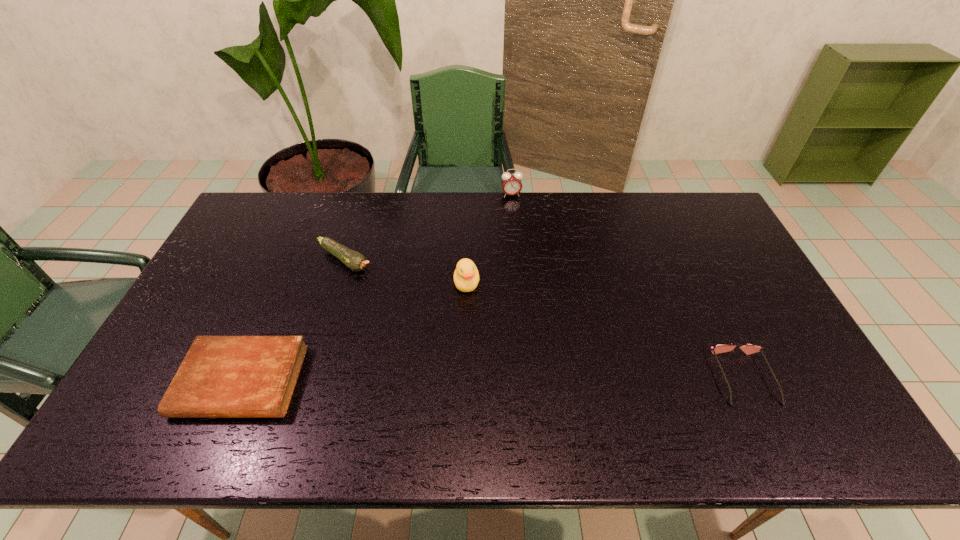
This screenshot has width=960, height=540. In order to click on vacant space on the desktop that is between the Bible and the rightmost object and is positioned on the clock face of the fourth object from left to right in this screenshot , I will do `click(557, 379)`.

Identify the location of vacant space on the desktop that is between the Bible and the rightmost object and is positioned on the face of the third object from left to right. (468, 380).

Where is `vacant space on the desktop that is between the Bible and the rightmost object and is positioned at the blossom end of the zucchini`? vacant space on the desktop that is between the Bible and the rightmost object and is positioned at the blossom end of the zucchini is located at coordinates (506, 379).